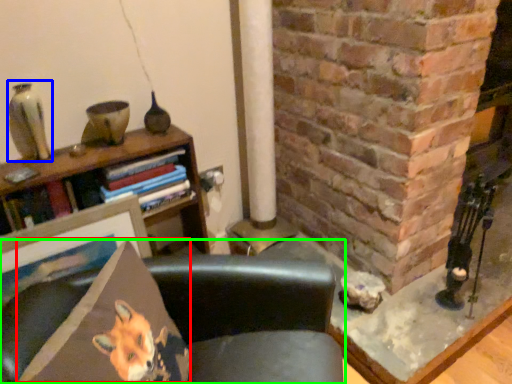
Question: Which object is positioned farthest from throw pillow (highlighted by a red box)? Select from gray (highlighted by a blue box) and chair (highlighted by a green box).

Choices:
 (A) gray
 (B) chair

Answer: (A)